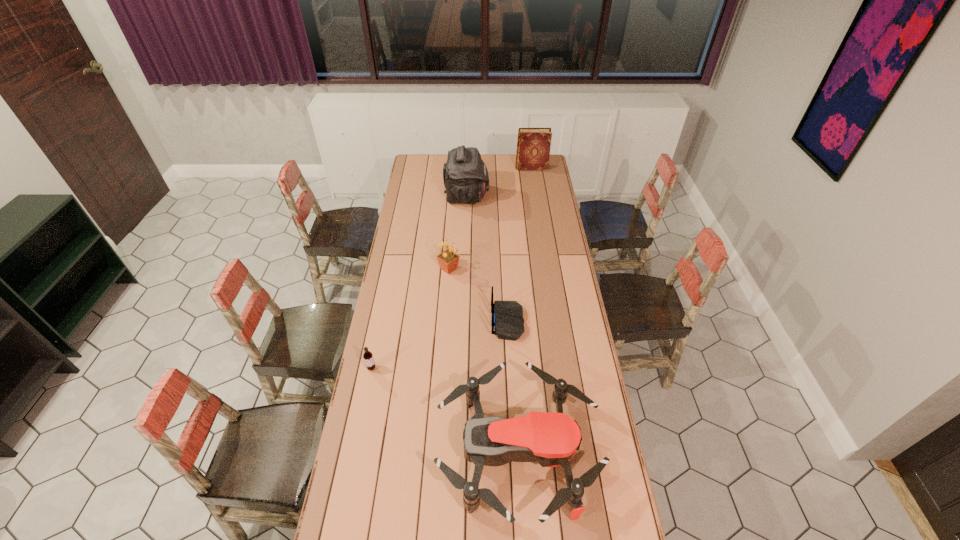
The width and height of the screenshot is (960, 540). What are the coordinates of `vacant space located on the open flap of the tallest object` in the screenshot? It's located at (540, 197).

Where is `vacant region located 0.150m on the spine side of the farthest object`? Image resolution: width=960 pixels, height=540 pixels. vacant region located 0.150m on the spine side of the farthest object is located at coordinates click(x=492, y=168).

The image size is (960, 540). I want to click on vacant area situated 0.180m on the spine side of the farthest object, so click(487, 168).

At what (x,y) coordinates should I click in order to perform the action: click on vacant point located 0.220m on the spine side of the farthest object. Please return your answer as a coordinate pair (x, y). Looking at the image, I should click on pyautogui.click(x=480, y=168).

Locate an element on the screen. The height and width of the screenshot is (540, 960). vacant space located 0.170m at the front of the fourth shortest object with flowers visible is located at coordinates (446, 305).

What are the coordinates of `free region located 0.130m on the camera side of the nearest object` in the screenshot? It's located at (399, 453).

Find the location of a particular element. vacant space positioned on the camera side of the nearest object is located at coordinates (405, 453).

Where is `vacant space located on the camera side of the nearest object`? The width and height of the screenshot is (960, 540). vacant space located on the camera side of the nearest object is located at coordinates (384, 453).

This screenshot has height=540, width=960. Identify the location of vacant region located on the back of the fourth farthest object. (468, 322).

I want to click on vacant area situated 0.260m on the back of the fourth farthest object, so click(430, 322).